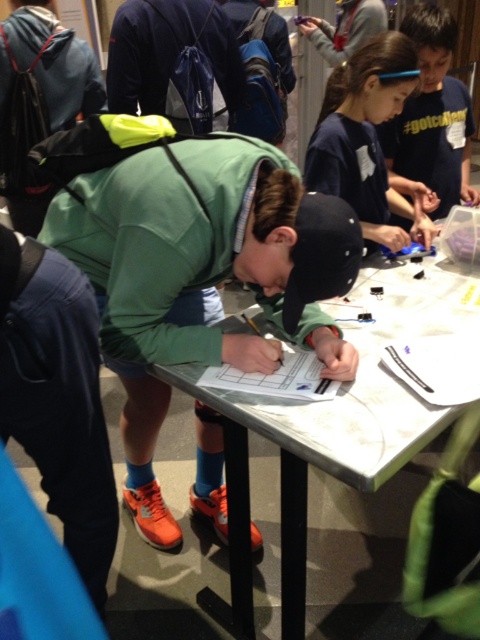
Question: Which object is farther from the camera taking this photo?

Choices:
 (A) white plastic table at center
 (B) green matte shirt at center

Answer: (B)

Question: Can you confirm if green matte shirt at center is smaller than blue cotton shirt at upper right?

Choices:
 (A) no
 (B) yes

Answer: (A)

Question: Is white plastic table at center thinner than dark blue shirt at upper center?

Choices:
 (A) no
 (B) yes

Answer: (A)

Question: Does green matte shirt at center appear over white plastic table at center?

Choices:
 (A) yes
 (B) no

Answer: (A)

Question: Which of the following is the closest to the observer?

Choices:
 (A) (326, 371)
 (B) (435, 161)
 (C) (364, 212)

Answer: (A)

Question: Which point is closer to the camera?

Choices:
 (A) (238, 256)
 (B) (420, 205)

Answer: (A)